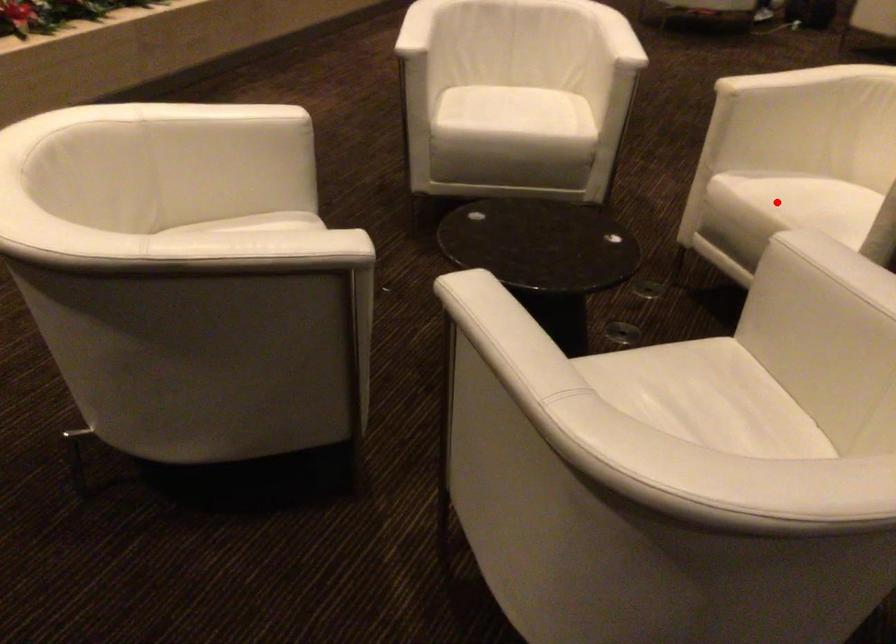
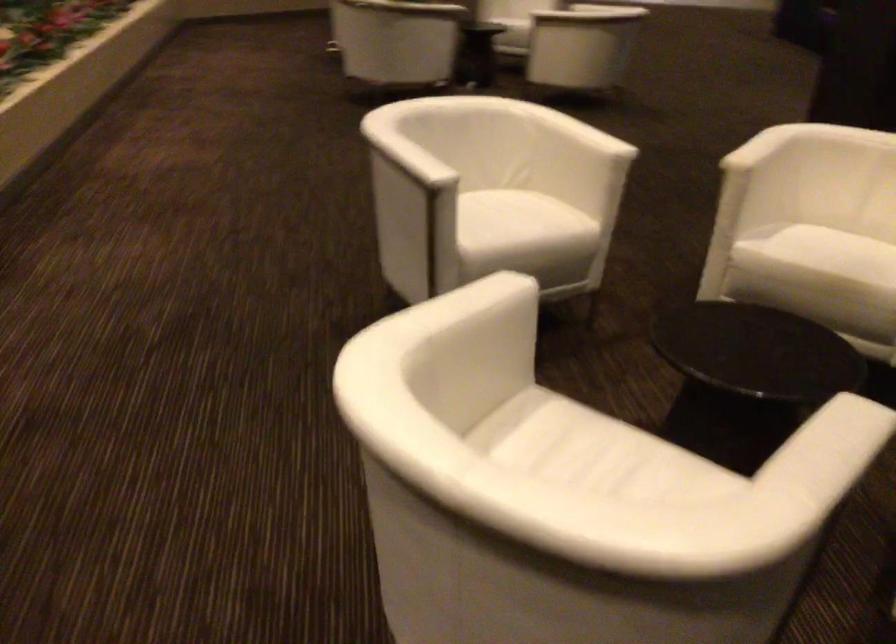
Locate, in the second image, the point that corresponds to the highlighted location in the first image.

(836, 252)